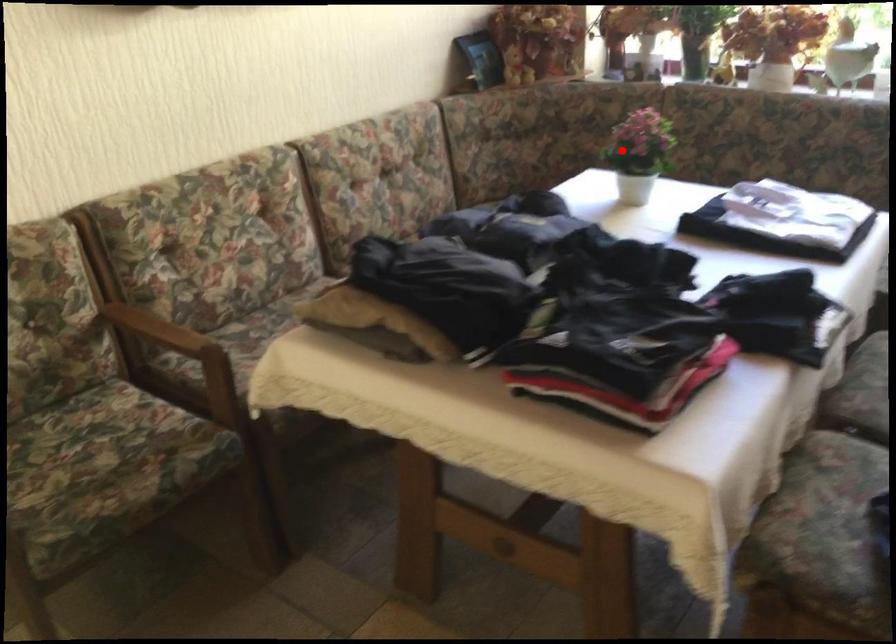
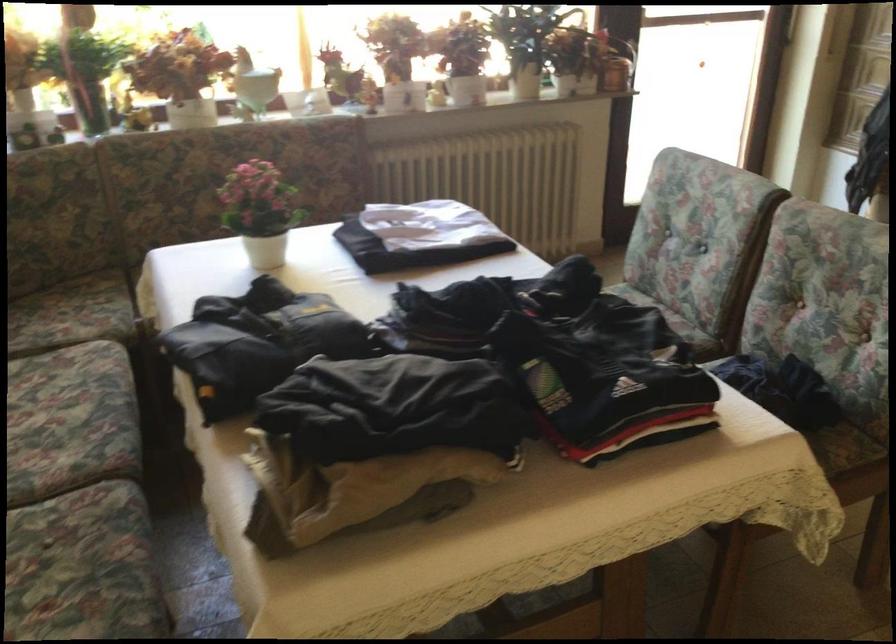
Locate, in the second image, the point that corresponds to the highlighted location in the first image.

(261, 212)